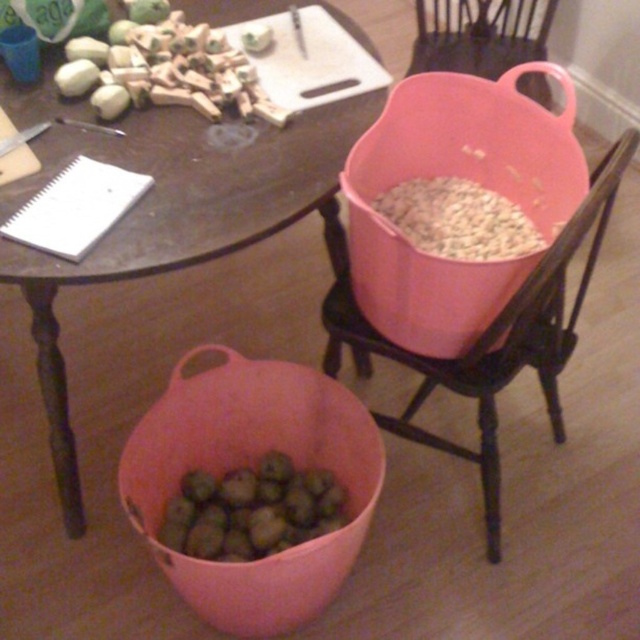
Does matte pink bowl at lower left appear under white matte seeds at upper right?

Yes, matte pink bowl at lower left is below white matte seeds at upper right.

Where is `matte pink bowl at lower left`? matte pink bowl at lower left is located at coordinates (253, 465).

You are a GUI agent. You are given a task and a screenshot of the screen. Output one action in this format:
    pyautogui.click(x=<x>, y=<y>)
    Task: Click on the matte wood table at center
    Image resolution: width=640 pixels, height=640 pixels.
    Given the screenshot: What is the action you would take?
    pyautogui.click(x=177, y=220)

Is point (108, 148) positioned in front of point (212, 608)?

Yes, point (108, 148) is in front of point (212, 608).

Who is more distant from viewer, (196, 196) or (298, 595)?

The point (298, 595) is behind.

The height and width of the screenshot is (640, 640). Find the location of `matte wood table at center`. matte wood table at center is located at coordinates point(177,220).

Does green matte wooden pieces at upper left come behind pink plastic chair at upper center?

That is False.

Is point (156, 61) positioned in front of point (528, 29)?

Yes.

The height and width of the screenshot is (640, 640). Find the location of `green matte wooden pieces at upper left`. green matte wooden pieces at upper left is located at coordinates (164, 70).